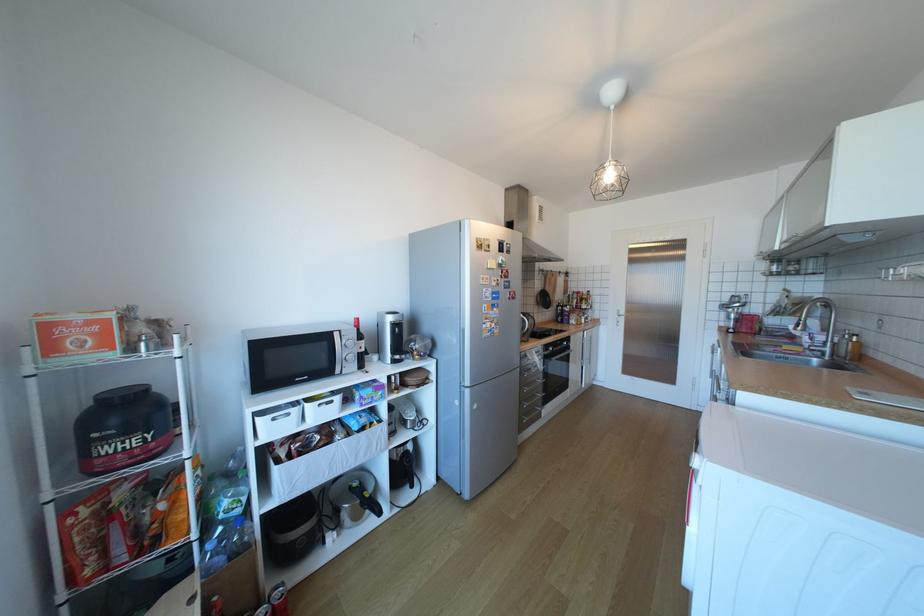
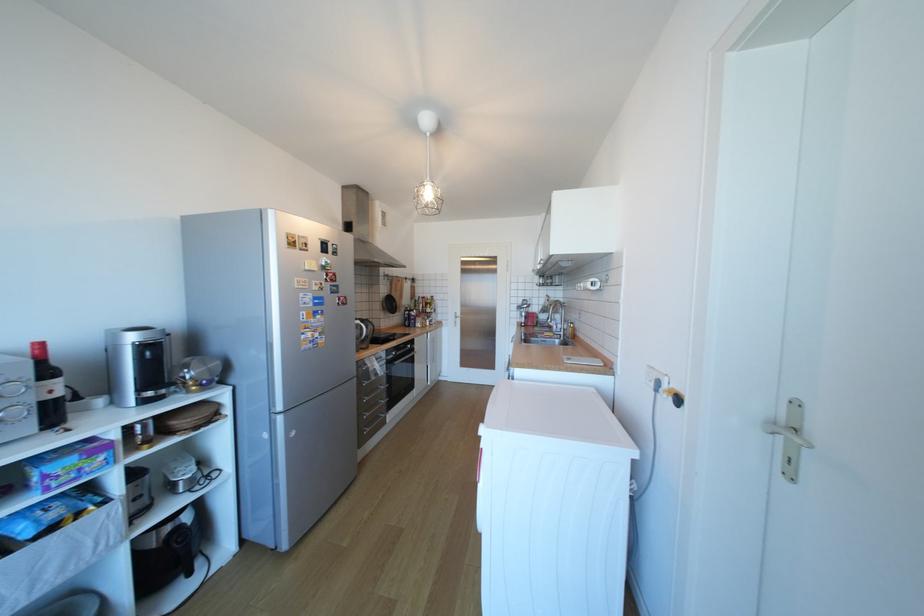
Question: How did the camera likely rotate?

Choices:
 (A) Left
 (B) Right
 (C) Up
 (D) Down

Answer: (B)